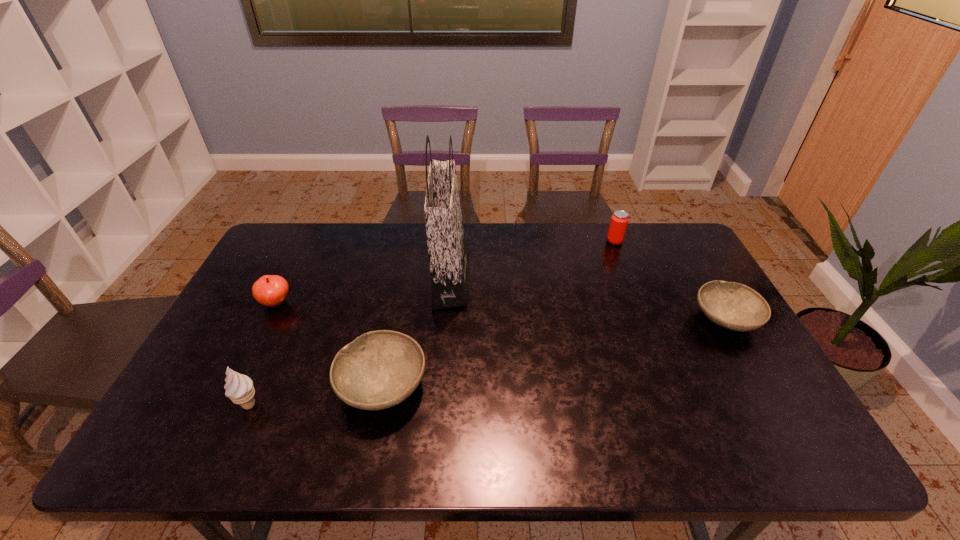
The width and height of the screenshot is (960, 540). I want to click on icecream that is positioned at the left edge, so click(239, 388).

In order to click on object present at the right edge in this screenshot , I will do [x=734, y=306].

Find the location of `object that is at the near left corner`. object that is at the near left corner is located at coordinates (239, 388).

The height and width of the screenshot is (540, 960). I want to click on vacant space at the far edge of the desktop, so click(332, 241).

At what (x,y) coordinates should I click in order to perform the action: click on free space at the near edge of the desktop. Please return your answer as a coordinate pair (x, y). This screenshot has width=960, height=540. Looking at the image, I should click on (490, 392).

In the image, there is a desktop. Where is `free space at the left edge`? This screenshot has width=960, height=540. free space at the left edge is located at coordinates (231, 357).

Locate an element on the screen. This screenshot has height=540, width=960. vacant space at the right edge of the desktop is located at coordinates (710, 384).

The image size is (960, 540). In order to click on vacant space at the near left corner of the desktop in this screenshot , I will do `click(193, 388)`.

The width and height of the screenshot is (960, 540). What are the coordinates of `vacant space at the near right corner of the desktop` in the screenshot? It's located at (744, 391).

I want to click on free area in between the nearer bowl and the beer can, so click(498, 314).